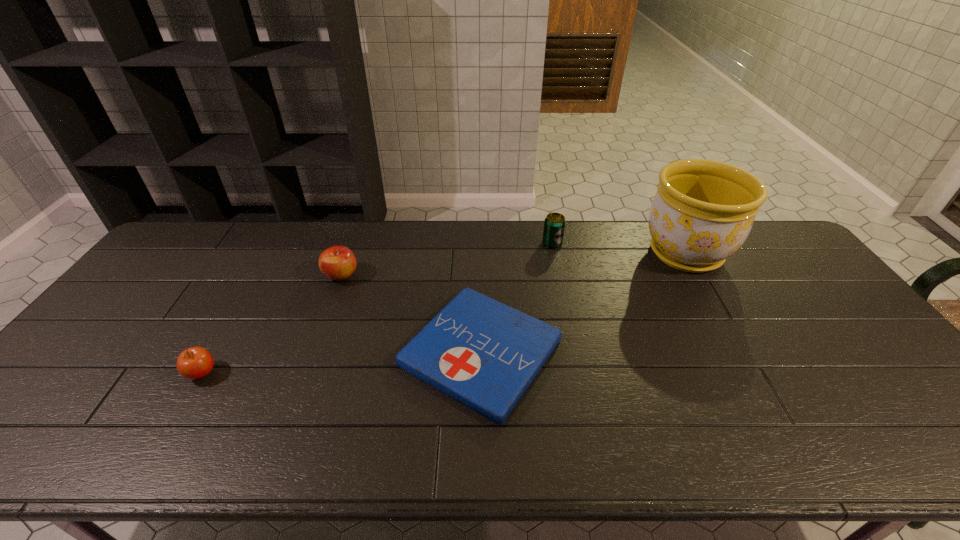
Identify the location of the rightmost object. (703, 211).

Where is `the tallest object`? Image resolution: width=960 pixels, height=540 pixels. the tallest object is located at coordinates (703, 211).

The height and width of the screenshot is (540, 960). Identify the location of beer can. (554, 225).

Where is `the fourth object from right to left`? This screenshot has height=540, width=960. the fourth object from right to left is located at coordinates (338, 262).

The image size is (960, 540). In order to click on the farther apple in this screenshot , I will do `click(338, 262)`.

Find the location of a particular element. This screenshot has width=960, height=540. the nearer apple is located at coordinates (194, 363).

This screenshot has height=540, width=960. I want to click on the left apple, so click(x=194, y=363).

At what (x,y) coordinates should I click in order to perform the action: click on the first-aid kit. Please return your answer as a coordinate pair (x, y). Looking at the image, I should click on (484, 354).

This screenshot has width=960, height=540. Find the location of `free point located 0.080m on the left of the rightmost object`. free point located 0.080m on the left of the rightmost object is located at coordinates (616, 253).

I want to click on vacant space located 0.330m on the front of the beer can, so click(568, 321).